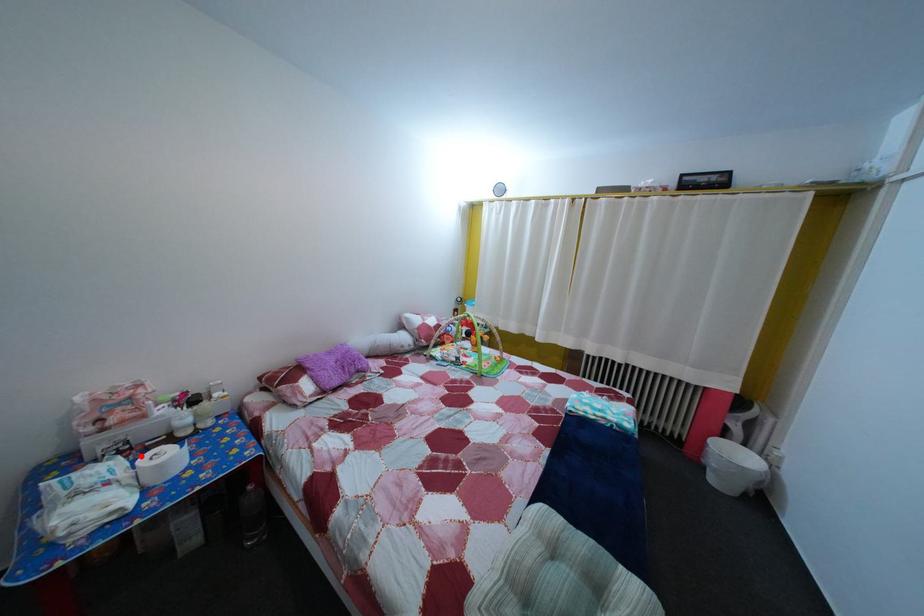
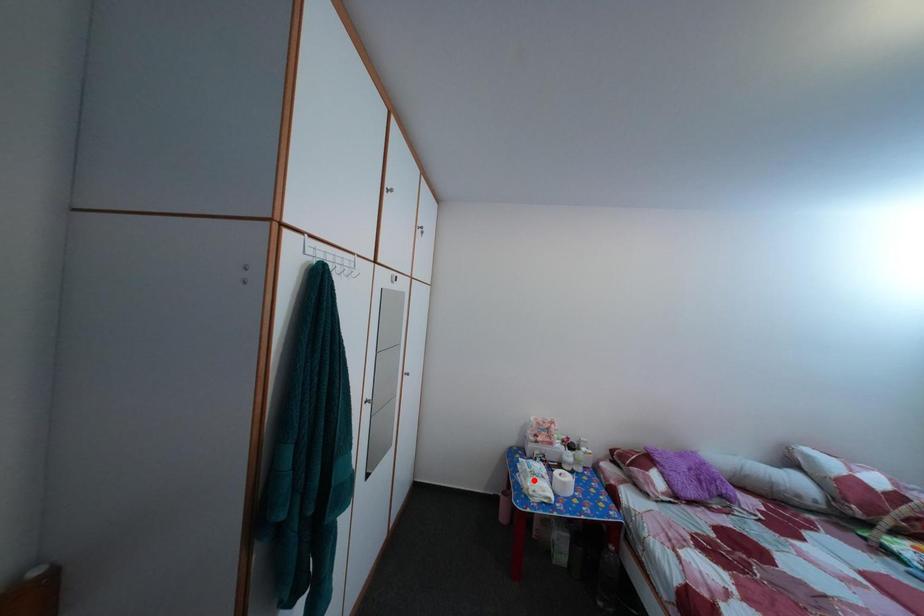
I am providing you with two images of the same scene from different viewpoints. A red point is marked on the first image and another point is marked on the second image. Does the point marked in image1 correspond to the same location as the one in image2?

No